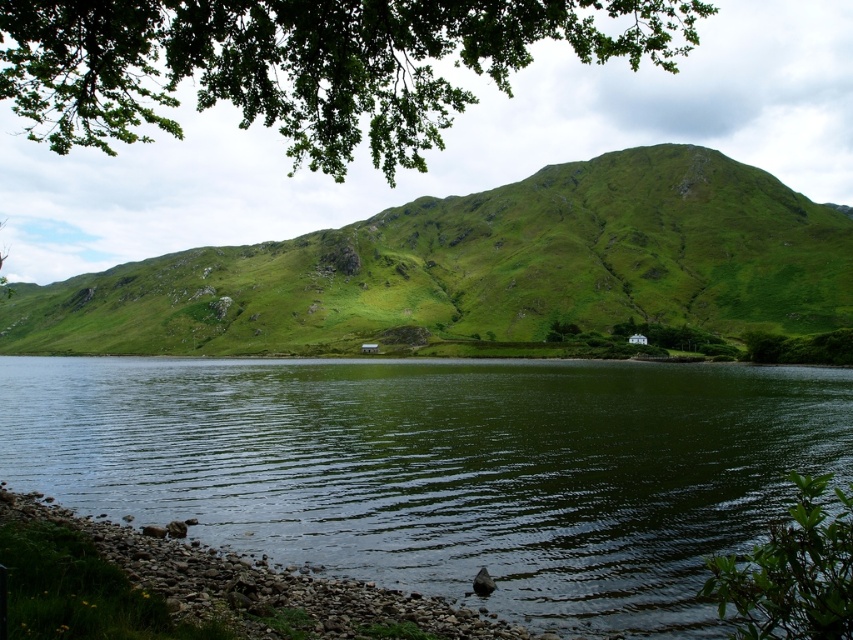
Question: Which point is closer to the camera?

Choices:
 (A) green grassy hill at upper center
 (B) smooth pebbles at lower left

Answer: (B)

Question: Which object is positioned closest to the smooth pebbles at lower left?

Choices:
 (A) green reflective water at center
 (B) green grassy hill at upper center
 (C) green leafy tree at upper center

Answer: (A)

Question: Can you confirm if green grassy hill at upper center is positioned above green leafy tree at upper center?

Choices:
 (A) no
 (B) yes

Answer: (A)

Question: Does green reflective water at center appear on the right side of smooth pebbles at lower left?

Choices:
 (A) no
 (B) yes

Answer: (B)

Question: Is the position of green reflective water at center less distant than that of green grassy hill at upper center?

Choices:
 (A) no
 (B) yes

Answer: (B)

Question: Which object appears farthest from the camera in this image?

Choices:
 (A) green reflective water at center
 (B) green leafy tree at upper center

Answer: (A)